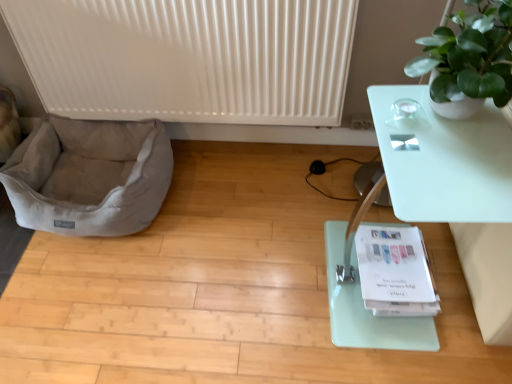
In order to click on free space above white paper yoga mat at lower center (from a real-world perspective) in this screenshot , I will do `click(392, 258)`.